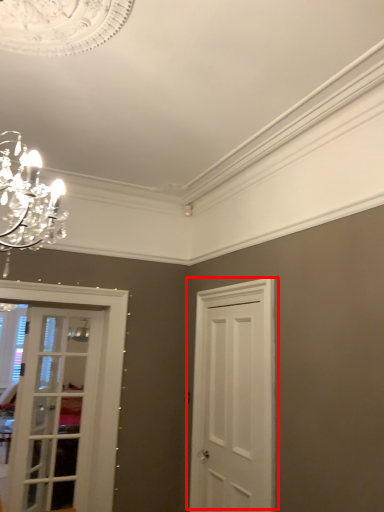
Question: From the image's perspective, where is door (annotated by the red box) located in relation to door in the image?

Choices:
 (A) below
 (B) above

Answer: (B)